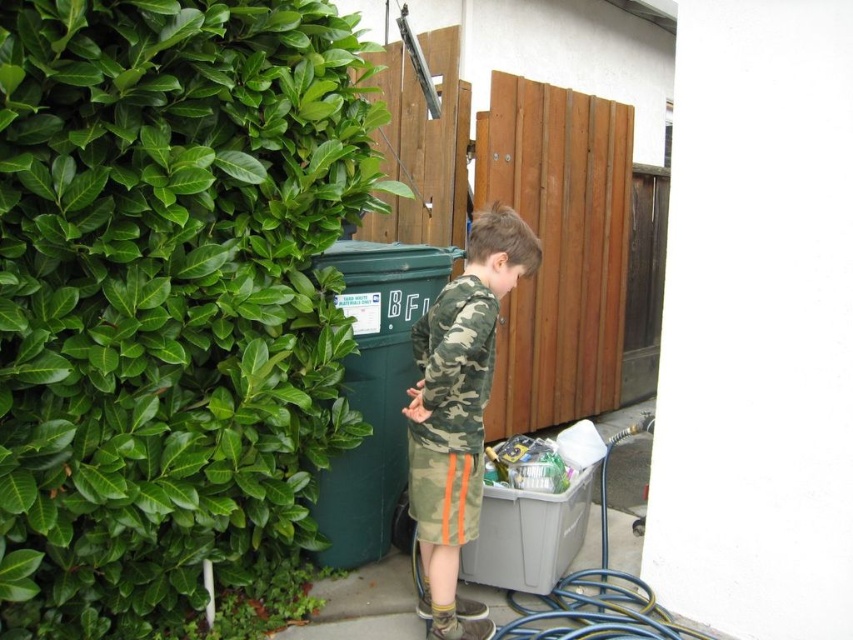
In order to click on green leafy hedge at left in this screenshot , I will do `click(167, 294)`.

Does green leafy hedge at left appear on the left side of green plastic recycling bin at center-left?

Indeed, green leafy hedge at left is positioned on the left side of green plastic recycling bin at center-left.

Consider the image. Who is more distant from viewer, (x=96, y=385) or (x=405, y=506)?

Positioned behind is point (x=405, y=506).

The height and width of the screenshot is (640, 853). Identify the location of green leafy hedge at left. (167, 294).

Is point (125, 429) in front of point (602, 460)?

That is True.

Locate an element on the screen. green leafy hedge at left is located at coordinates (167, 294).

Find the location of `green leafy hedge at left`. green leafy hedge at left is located at coordinates (167, 294).

Is green plastic recycling bin at center-left wider than blue rubber garden hose at lower right?

No.

Is the position of green plastic recycling bin at center-left less distant than that of blue rubber garden hose at lower right?

No, green plastic recycling bin at center-left is behind blue rubber garden hose at lower right.

Is point (387, 401) farther from viewer compared to point (552, 589)?

Yes, it is behind point (552, 589).

You are a GUI agent. You are given a task and a screenshot of the screen. Output one action in this format:
    pyautogui.click(x=<x>, y=<y>)
    Task: Click on the green plastic recycling bin at center-left
    The height and width of the screenshot is (640, 853).
    Given the screenshot: What is the action you would take?
    pyautogui.click(x=375, y=394)